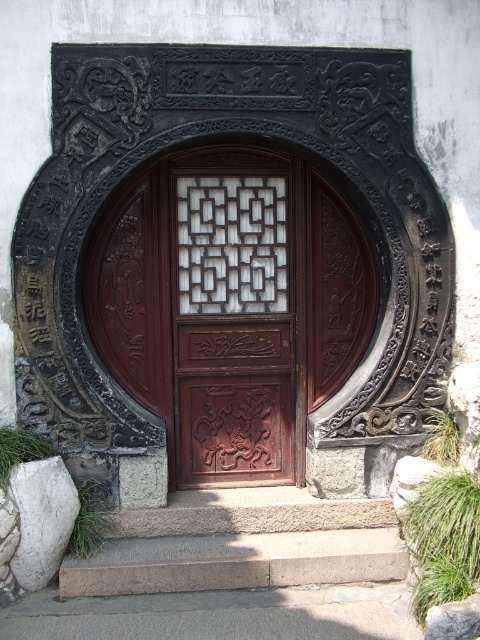
Question: Can you confirm if wooden carved door at center is bigger than white marble rock at lower left?

Choices:
 (A) no
 (B) yes

Answer: (B)

Question: Which object is farther from the camera taking this photo?

Choices:
 (A) polished wood door at center
 (B) wooden carved door at center
 (C) white marble rock at lower left

Answer: (B)

Question: Can you confirm if polished wood door at center is positioned above wooden carved door at center?

Choices:
 (A) no
 (B) yes

Answer: (B)

Question: Which object is the farthest from the wooden carved door at center?

Choices:
 (A) smooth stone steps at lower center
 (B) polished wood door at center

Answer: (A)

Question: From the image, what is the correct spatial relationship of polished wood door at center in relation to white marble rock at lower left?

Choices:
 (A) below
 (B) above

Answer: (B)

Question: Which object is farther from the camera taking this photo?

Choices:
 (A) wooden carved door at center
 (B) smooth stone steps at lower center

Answer: (A)